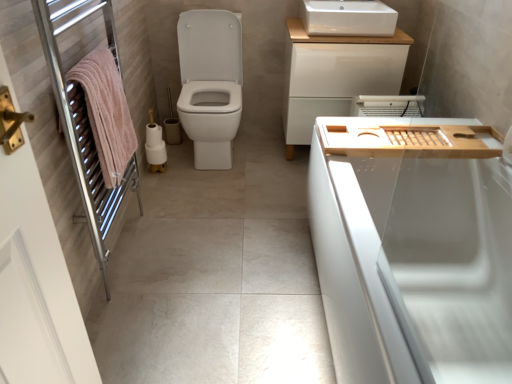
The image size is (512, 384). I want to click on vacant space to the right of pink towel at left, so click(206, 251).